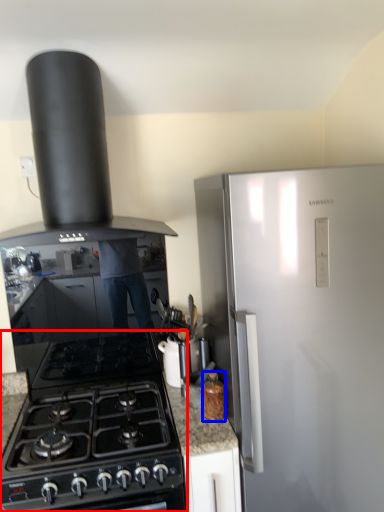
Question: Which object appears closest to the camera in this image, gas stove (highlighted by a red box) or kitchen appliance (highlighted by a blue box)?

Choices:
 (A) gas stove
 (B) kitchen appliance

Answer: (A)